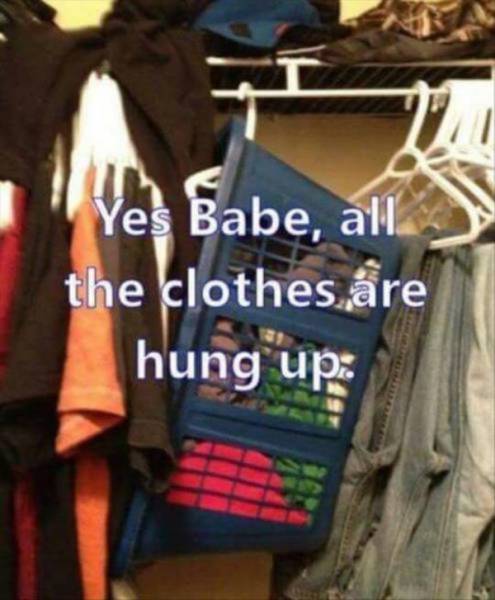
Identify the location of closet wall. (344, 141).